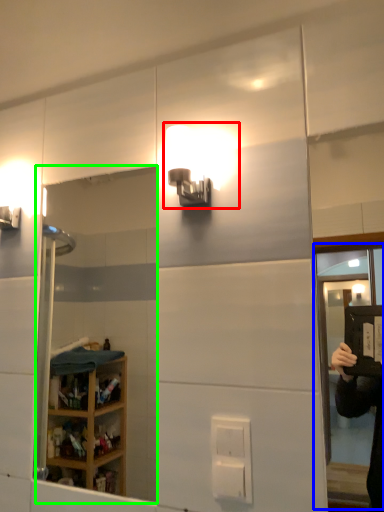
Question: Considering the real-world distances, which object is farthest from light fixture (highlighted by a red box)? screen door (highlighted by a blue box) or mirror (highlighted by a green box)?

Choices:
 (A) screen door
 (B) mirror

Answer: (A)